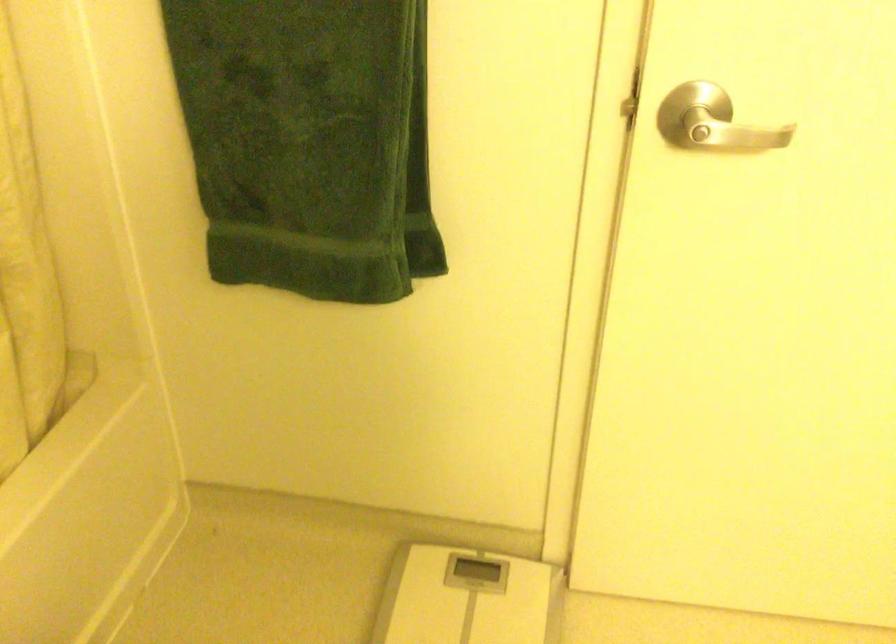
Find where to lift the white weighing scale. Please return your answer as a coordinate pair (x, y).

(469, 598)